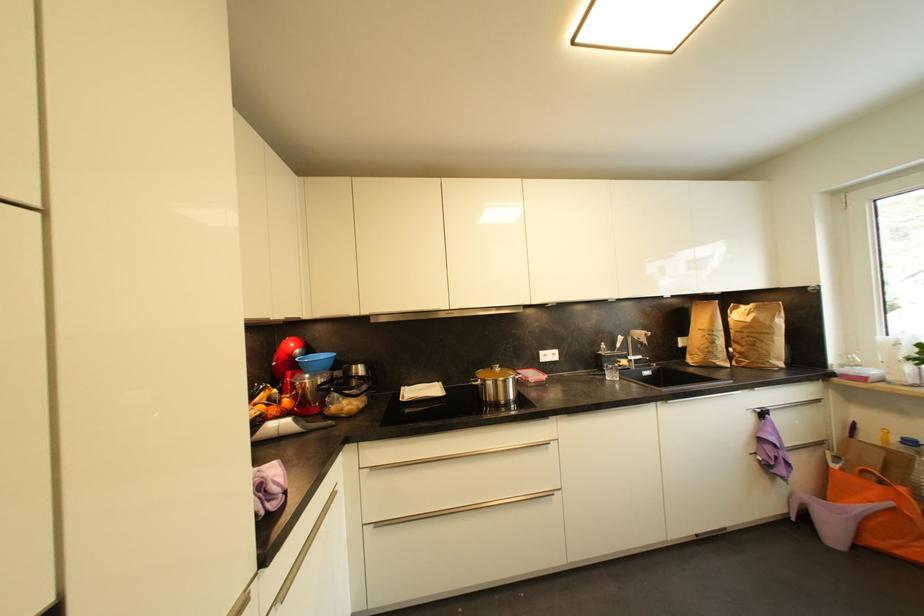
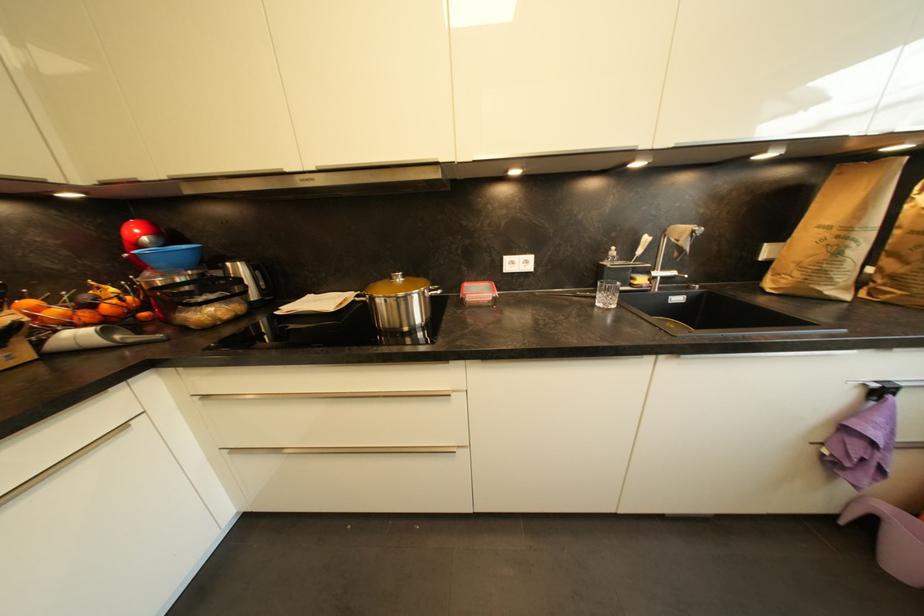
Question: The first image is from the beginning of the video and the second image is from the end. How did the camera likely rotate when shooting the video?

Choices:
 (A) Left
 (B) Right
 (C) Up
 (D) Down

Answer: (D)